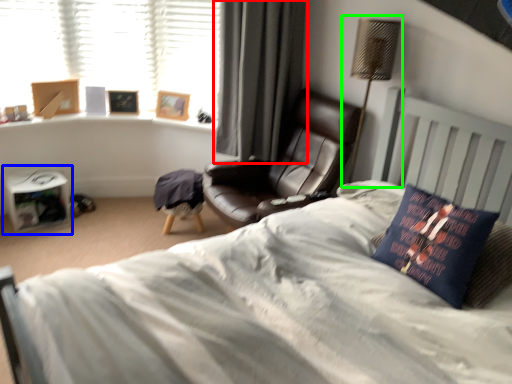
Question: Estimate the real-world distances between objects in this image. Which object is farther from curtain (highlighted by a red box), paperback book (highlighted by a blue box) or table lamp (highlighted by a green box)?

Choices:
 (A) paperback book
 (B) table lamp

Answer: (A)